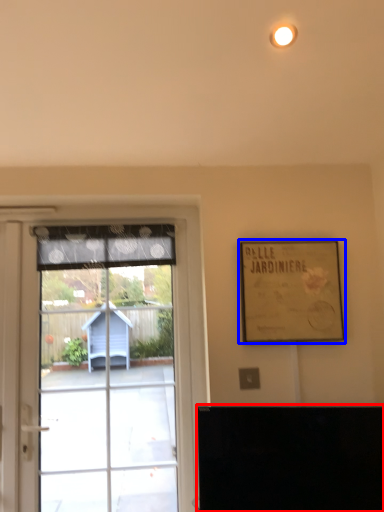
Question: Which point is closer to the camera, furniture (highlighted by a red box) or picture frame (highlighted by a blue box)?

Choices:
 (A) furniture
 (B) picture frame

Answer: (A)